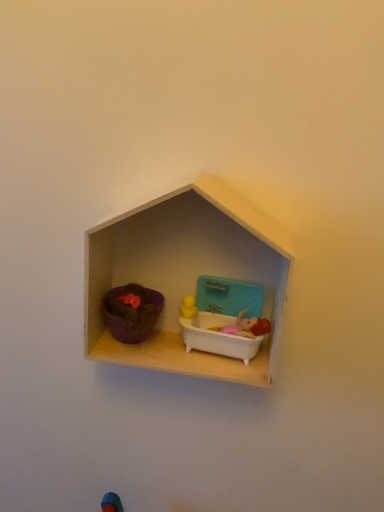
Question: Considering the relative sizes of white plastic bathtub at center, the 1th toy viewed from the right, and matte purple pot at left, which appears as the 1th toy when viewed from the left, in the image provided, is white plastic bathtub at center, the 1th toy viewed from the right, thinner than matte purple pot at left, which appears as the 1th toy when viewed from the left,?

Choices:
 (A) no
 (B) yes

Answer: (B)

Question: Is white plastic bathtub at center, which is the second toy from left to right, at the left side of matte purple pot at left, which appears as the 1th toy when viewed from the left?

Choices:
 (A) no
 (B) yes

Answer: (A)

Question: Is white plastic bathtub at center, the 1th toy viewed from the right, to the right of matte purple pot at left, which appears as the 1th toy when viewed from the left, from the viewer's perspective?

Choices:
 (A) yes
 (B) no

Answer: (A)

Question: Does white plastic bathtub at center, the 1th toy viewed from the right, turn towards matte purple pot at left, positioned as the 2th toy in right-to-left order?

Choices:
 (A) no
 (B) yes

Answer: (A)

Question: Is white plastic bathtub at center, which is the second toy from left to right, next to matte purple pot at left, positioned as the 2th toy in right-to-left order, and touching it?

Choices:
 (A) yes
 (B) no

Answer: (A)

Question: Considering the positions of matte purple pot at left, which appears as the 1th toy when viewed from the left, and white plastic bathtub at center, which is the second toy from left to right, in the image, is matte purple pot at left, which appears as the 1th toy when viewed from the left, wider or thinner than white plastic bathtub at center, which is the second toy from left to right,?

Choices:
 (A) thin
 (B) wide

Answer: (B)

Question: Do you think matte purple pot at left, positioned as the 2th toy in right-to-left order, is within white plastic bathtub at center, the 1th toy viewed from the right, or outside of it?

Choices:
 (A) inside
 (B) outside

Answer: (B)

Question: Considering their positions, is matte purple pot at left, which appears as the 1th toy when viewed from the left, located in front of or behind white plastic bathtub at center, which is the second toy from left to right?

Choices:
 (A) behind
 (B) front

Answer: (B)

Question: From the image's perspective, relative to white plastic bathtub at center, the 1th toy viewed from the right, is matte purple pot at left, positioned as the 2th toy in right-to-left order, above or below?

Choices:
 (A) above
 (B) below

Answer: (A)

Question: From the image's perspective, relative to matte purple pot at left, which appears as the 1th toy when viewed from the left, is wooden dollhouse at center above or below?

Choices:
 (A) below
 (B) above

Answer: (B)

Question: Is wooden dollhouse at center taller or shorter than matte purple pot at left, positioned as the 2th toy in right-to-left order?

Choices:
 (A) tall
 (B) short

Answer: (A)

Question: Looking at the image, does wooden dollhouse at center seem bigger or smaller compared to matte purple pot at left, positioned as the 2th toy in right-to-left order?

Choices:
 (A) big
 (B) small

Answer: (A)

Question: From a real-world perspective, relative to matte purple pot at left, which appears as the 1th toy when viewed from the left, is wooden dollhouse at center vertically above or below?

Choices:
 (A) above
 (B) below

Answer: (A)

Question: Is white plastic bathtub at center, which is the second toy from left to right, wider or thinner than wooden dollhouse at center?

Choices:
 (A) wide
 (B) thin

Answer: (B)

Question: From a real-world perspective, relative to wooden dollhouse at center, is white plastic bathtub at center, which is the second toy from left to right, vertically above or below?

Choices:
 (A) above
 (B) below

Answer: (B)